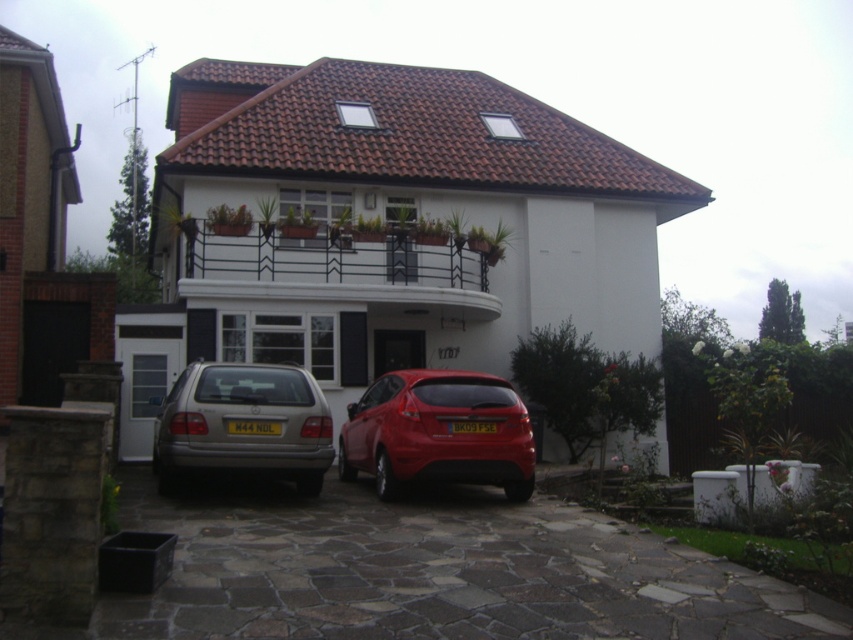
You are standing in front of a two story residential house with a white exterior and a red tiled roof. You see a glossy metallic hatchback at center. Can you determine if the hatchback is parked on the driveway?

The glossy metallic hatchback at center is parked on the driveway, which is paved with irregularly shaped stone slabs in front of the house.

You are a delivery person arriving at this house to drop off a package. You see the satin silver car at lower left and the yellow matte license plate at center. Which vehicle should you avoid parking next to to prevent blocking the driveway entrance?

The satin silver car at lower left is positioned on the left side of the yellow matte license plate at center. To prevent blocking the driveway entrance, avoid parking next to the satin silver car at lower left since it is closer to the entrance on the left side.